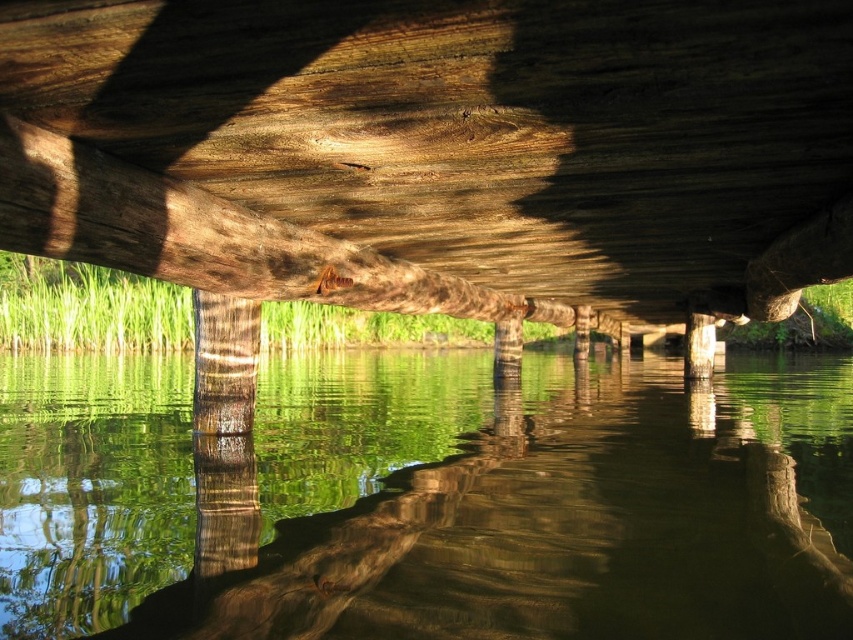
Does green reflective water at center appear on the right side of smooth brown tree trunk at center?

Yes, green reflective water at center is to the right of smooth brown tree trunk at center.

Find the location of a particular element. green reflective water at center is located at coordinates (430, 500).

Does point (817, 104) lie in front of point (241, 353)?

Yes, it is.

Is wooden beam at center above smooth brown tree trunk at center?

Yes, wooden beam at center is above smooth brown tree trunk at center.

Does point (801, 116) lie behind point (231, 346)?

No, it is not.

In order to click on wooden beam at center in this screenshot , I will do `click(438, 148)`.

Can you confirm if wooden beam at center is positioned below green reflective water at center?

No.

Is point (131, 205) more distant than point (90, 609)?

Yes, it is.

The width and height of the screenshot is (853, 640). I want to click on wooden beam at center, so click(438, 148).